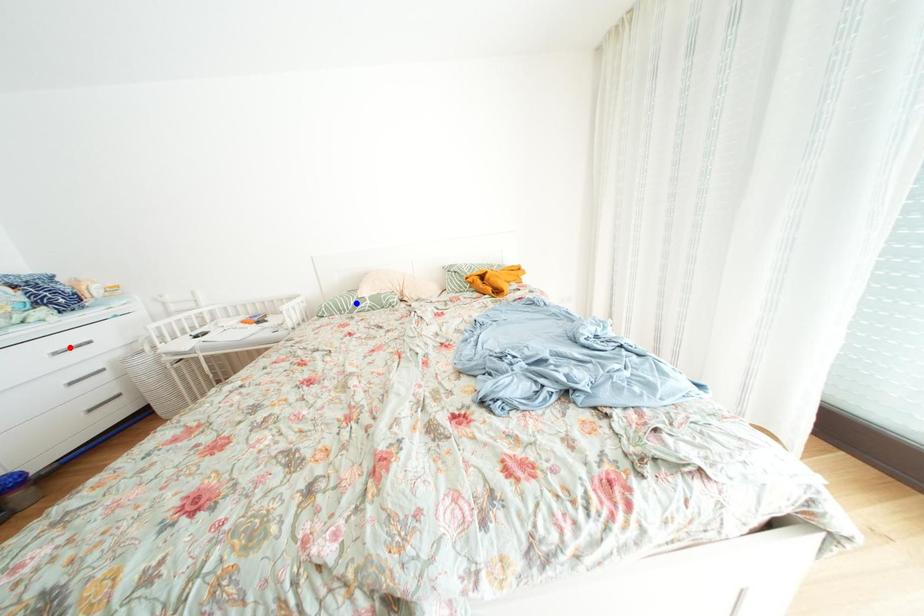
Question: In the image, two points are highlighted. Which point is nearer to the camera? Reply with the corresponding letter.

Choices:
 (A) blue point
 (B) red point

Answer: (B)